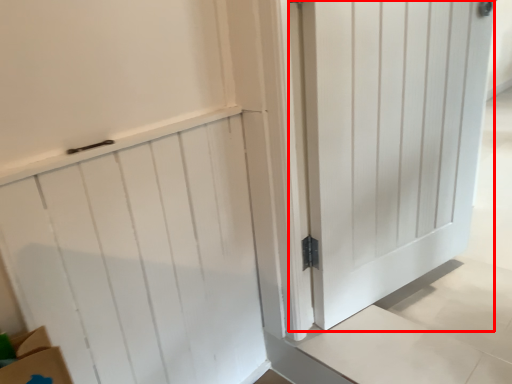
Question: Considering the relative positions of door (annotated by the red box) and door in the image provided, where is door (annotated by the red box) located with respect to the staircase?

Choices:
 (A) left
 (B) right

Answer: (B)